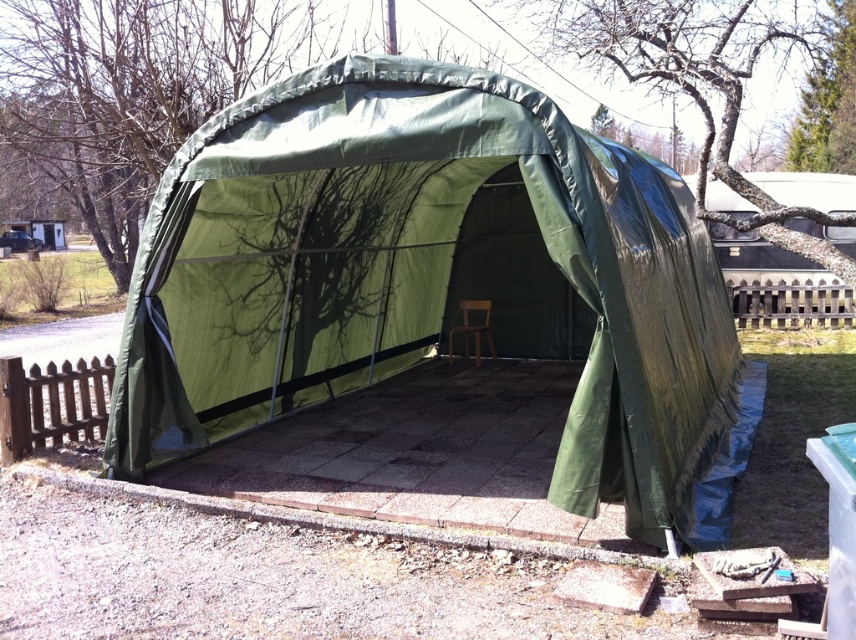
Can you confirm if green fabric tent at center is bigger than brown matte chair at center?

Indeed, green fabric tent at center has a larger size compared to brown matte chair at center.

Is green fabric tent at center to the left of brown matte chair at center from the viewer's perspective?

Incorrect, green fabric tent at center is not on the left side of brown matte chair at center.

Measure the distance between green fabric tent at center and camera.

The distance of green fabric tent at center from camera is 4.35 meters.

You are a GUI agent. You are given a task and a screenshot of the screen. Output one action in this format:
    pyautogui.click(x=<x>, y=<y>)
    Task: Click on the green fabric tent at center
    The width and height of the screenshot is (856, 640).
    Given the screenshot: What is the action you would take?
    pyautogui.click(x=432, y=280)